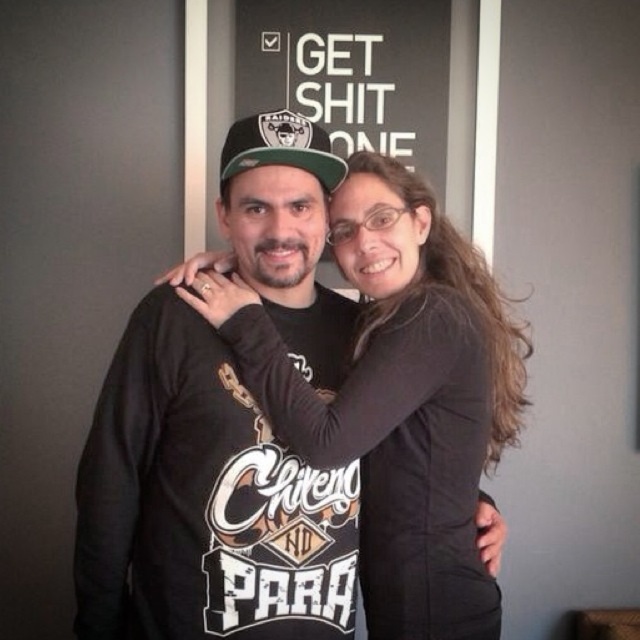
Is black matte shirt at center to the left of camo fabric baseball cap at center from the viewer's perspective?

No, black matte shirt at center is not to the left of camo fabric baseball cap at center.

Does black matte shirt at center have a greater height compared to camo fabric baseball cap at center?

Correct, black matte shirt at center is much taller as camo fabric baseball cap at center.

Image resolution: width=640 pixels, height=640 pixels. Describe the element at coordinates (406, 401) in the screenshot. I see `black matte shirt at center` at that location.

The height and width of the screenshot is (640, 640). I want to click on black matte shirt at center, so click(406, 401).